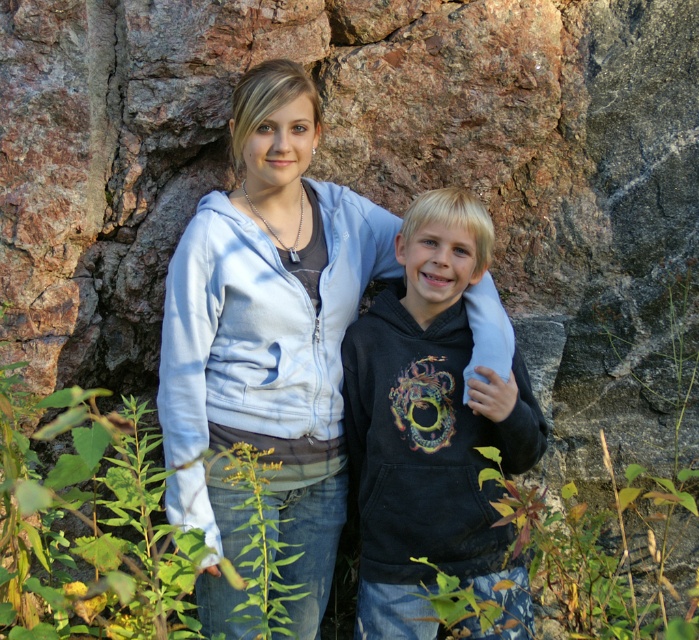
Question: Which of the following is the farthest from the observer?

Choices:
 (A) light blue zip-up hoodie at center
 (B) black matte hoodie at center

Answer: (A)

Question: Can you confirm if light blue zip-up hoodie at center is positioned to the right of black matte hoodie at center?

Choices:
 (A) no
 (B) yes

Answer: (A)

Question: Does light blue zip-up hoodie at center lie behind black matte hoodie at center?

Choices:
 (A) no
 (B) yes

Answer: (B)

Question: Does light blue zip-up hoodie at center appear on the left side of black matte hoodie at center?

Choices:
 (A) no
 (B) yes

Answer: (B)